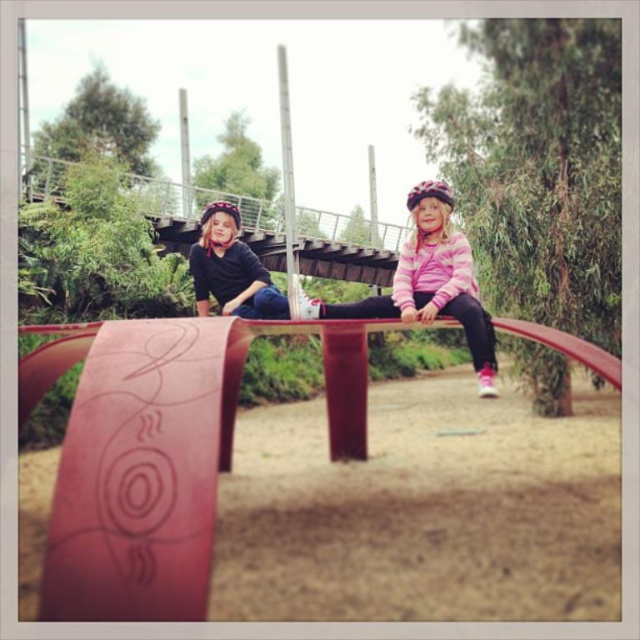
Question: Is pink striped sweater at center wider than matte black helmet at upper center?

Choices:
 (A) no
 (B) yes

Answer: (B)

Question: Among these points, which one is farthest from the camera?

Choices:
 (A) click(410, 211)
 (B) click(243, 284)

Answer: (B)

Question: Which object is farther from the camera taking this photo?

Choices:
 (A) matte black helmet at upper center
 (B) pink striped sweater at center

Answer: (A)

Question: Is pink striped sweater at center to the left of matte black helmet at upper center from the viewer's perspective?

Choices:
 (A) yes
 (B) no

Answer: (B)

Question: From the image, what is the correct spatial relationship of pink striped sweater at center in relation to matte black helmet at upper center?

Choices:
 (A) left
 (B) right

Answer: (B)

Question: Among these objects, which one is nearest to the camera?

Choices:
 (A) matte black helmet at upper center
 (B) pink striped sweater at center

Answer: (B)